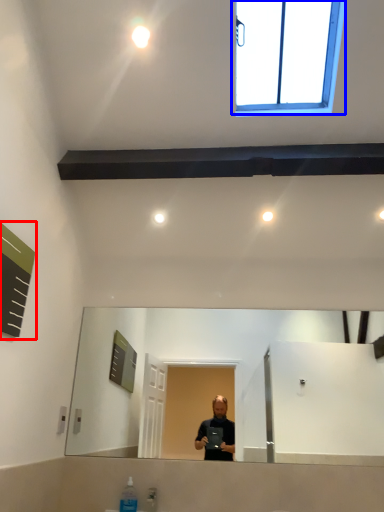
Question: Which point is further to the camera, bulletin board (highlighted by a red box) or window (highlighted by a blue box)?

Choices:
 (A) bulletin board
 (B) window

Answer: (B)